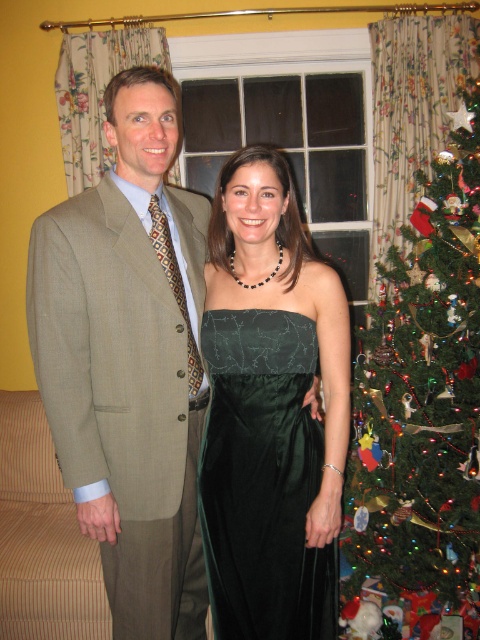
You are organizing a photoshoot and need to arrange two green dresses from left to right. The velvet green dress at center and the satin dark green dress at center are available. According to the image, which dress should be placed on the left side?

The velvet green dress at center should be placed on the left side because it is positioned on the left side of the satin dark green dress at center in the image.

You are a photographer setting up for a group photo in the living room. The green velvet christmas tree at right is in the frame. Where should you position the camera to ensure the tree is centered in the shot?

To center the green velvet christmas tree at right in the shot, position the camera at the coordinates corresponding to the tree location, which is at point (421, 401).

You are planning to take a photo of the green velvet christmas tree at right and the satin dark green dress at center. Which object should you focus on first if you want to capture both in the frame without moving the camera?

The green velvet christmas tree at right is larger in size than the satin dark green dress at center, so you should focus on the green velvet christmas tree at right first to ensure it fits properly in the frame.